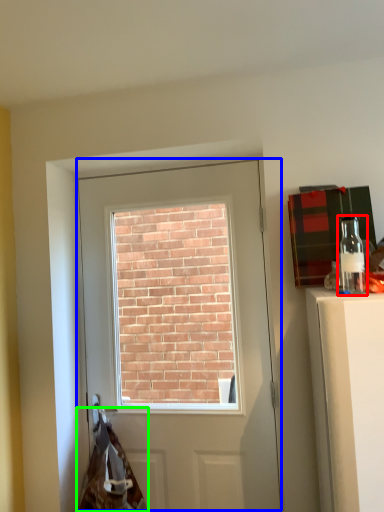
Question: Considering the real-world distances, which object is farthest from bottle (highlighted by a red box)? door (highlighted by a blue box) or material (highlighted by a green box)?

Choices:
 (A) door
 (B) material

Answer: (B)